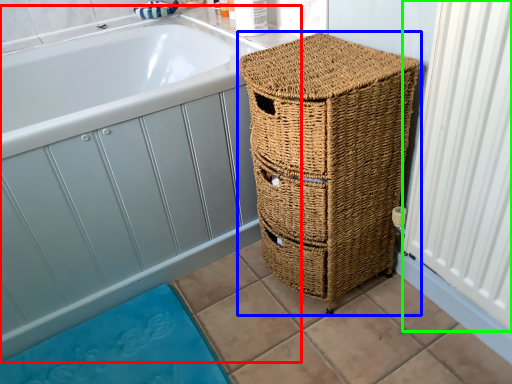
Question: Estimate the real-world distances between objects in this image. Which object is farther from bath (highlighted by a red box), furniture (highlighted by a blue box) or radiator (highlighted by a green box)?

Choices:
 (A) furniture
 (B) radiator

Answer: (B)